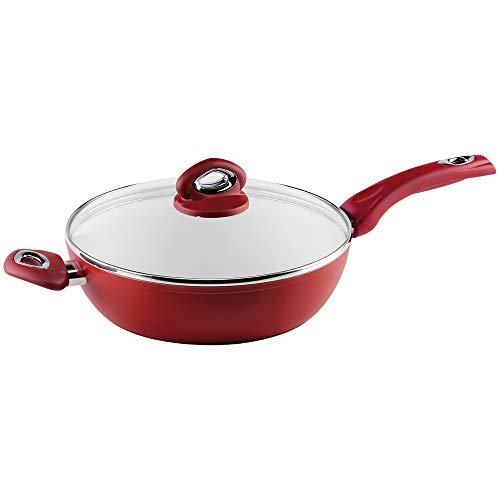
Where can where you'd hold utensils be observed in this image? Your answer should be formatted as a list of tuples, i.e. [(x1, y1), (x2, y2), ...], where each tuple contains the x and y coordinates of a point satisfying the conditions above.

[(461, 161)]